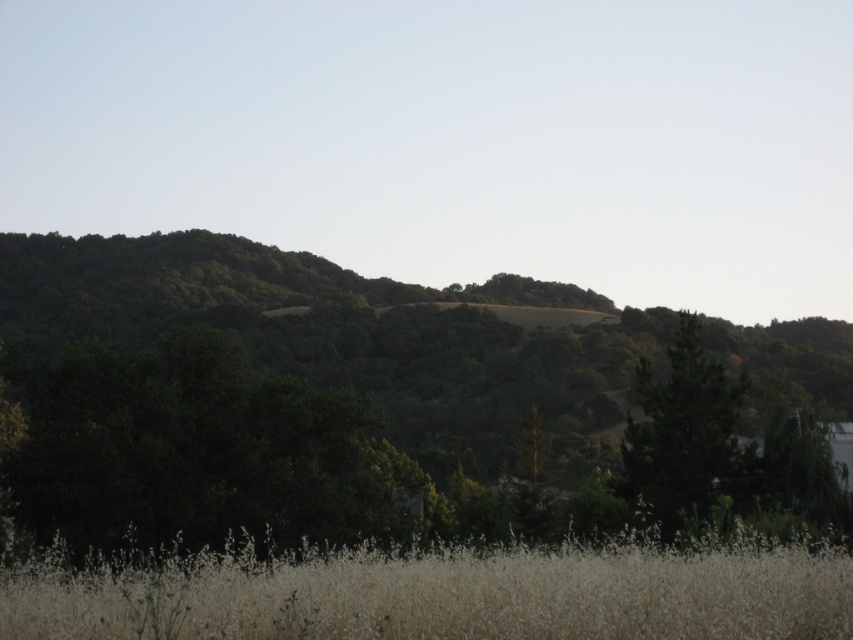
You are standing in the field of tall dry grasses and want to reach the green leafy tree at center. Which direction should you move to avoid the white soft grass at lower center?

Since the green leafy tree at center is positioned under the white soft grass at lower center, you should move sideways away from the white soft grass at lower center to reach the tree without going through it.

You are a landscape photographer planning to capture the scene from the lower center to the right side. Which object between the white soft grass at lower center and the green matte tree at right would dominate the frame in terms of visual space?

The green matte tree at right occupies more space than the white soft grass at lower center, so it would dominate the frame in terms of visual space.